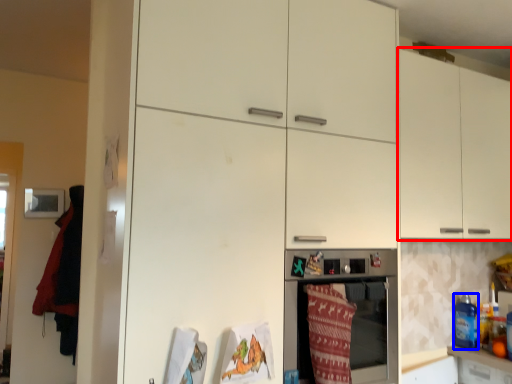
Question: Among these objects, which one is nearest to the camera, cabinetry (highlighted by a red box) or beverage (highlighted by a blue box)?

Choices:
 (A) cabinetry
 (B) beverage

Answer: (A)